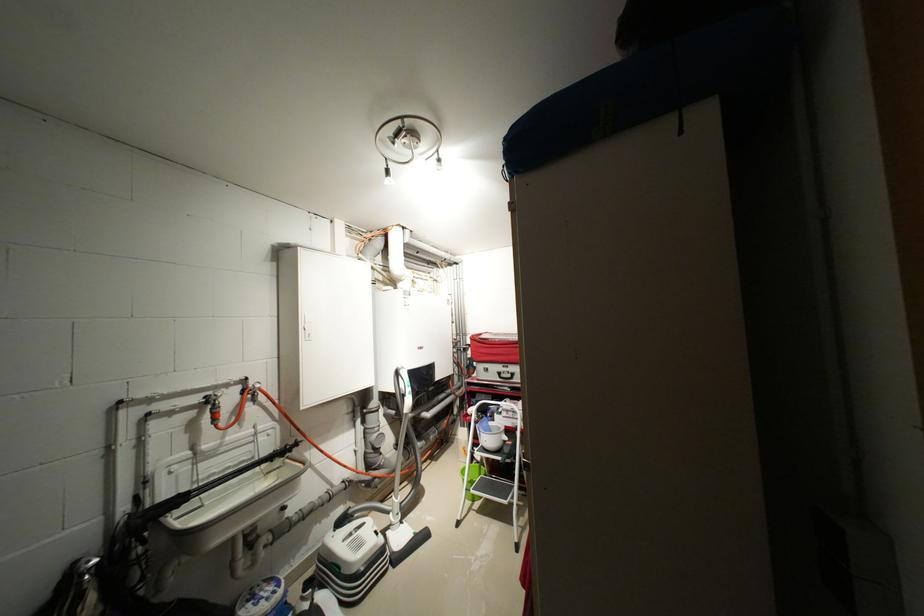
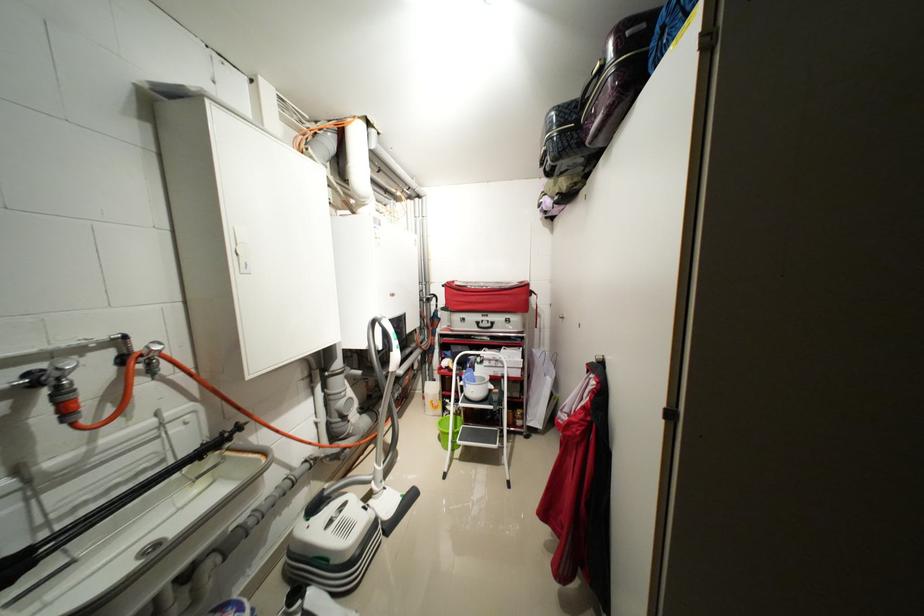
In a continuous first-person perspective shot, in which direction is the camera moving?

The cameraman moved toward left, forward.